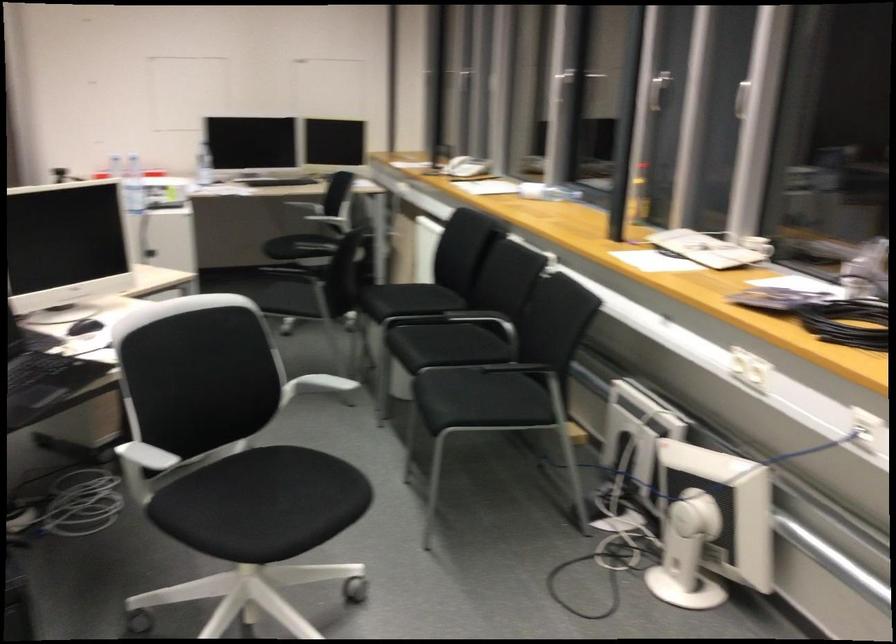
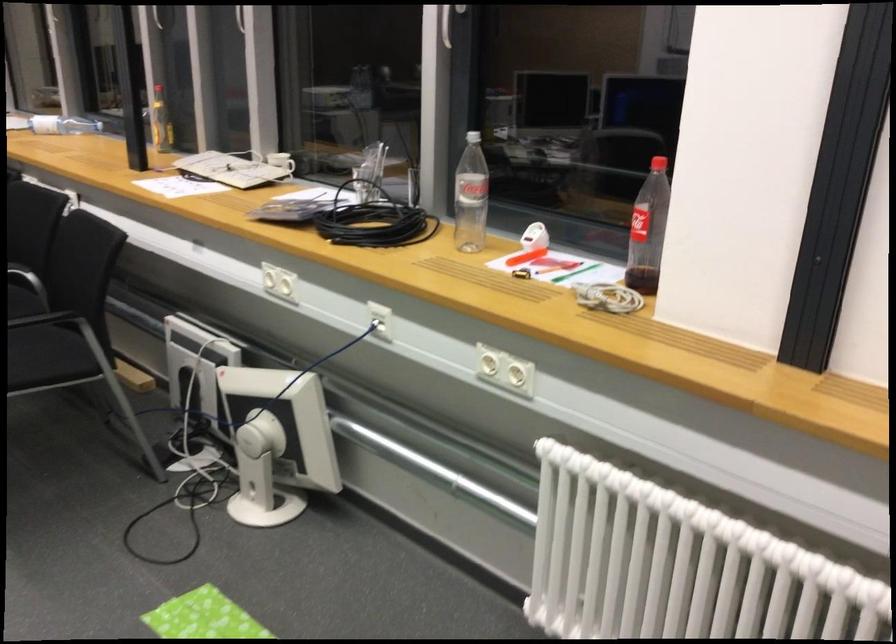
Locate, in the second image, the point that corresponds to point 629,438 in the first image.

(196, 375)